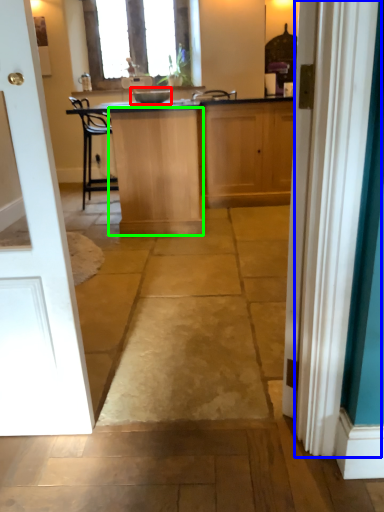
Question: Considering the real-world distances, which object is closest to appliance (highlighted by a red box)? curtain (highlighted by a blue box) or cabinetry (highlighted by a green box).

Choices:
 (A) curtain
 (B) cabinetry

Answer: (B)